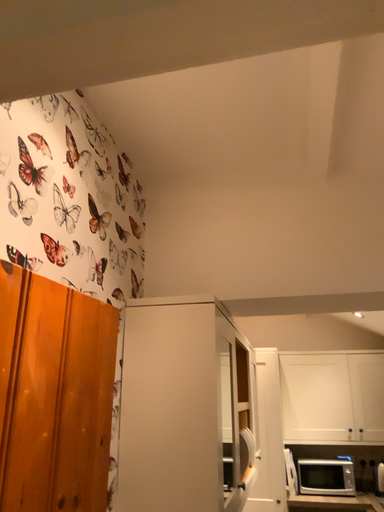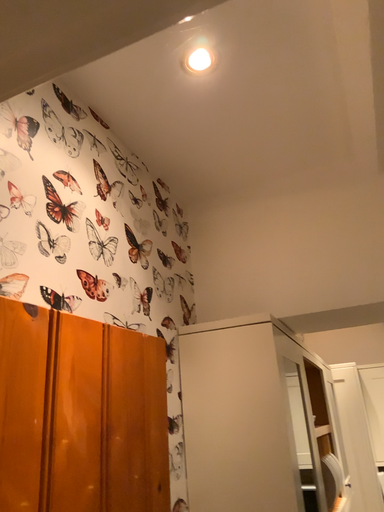
Question: How did the camera likely rotate when shooting the video?

Choices:
 (A) rotated left
 (B) rotated right

Answer: (A)